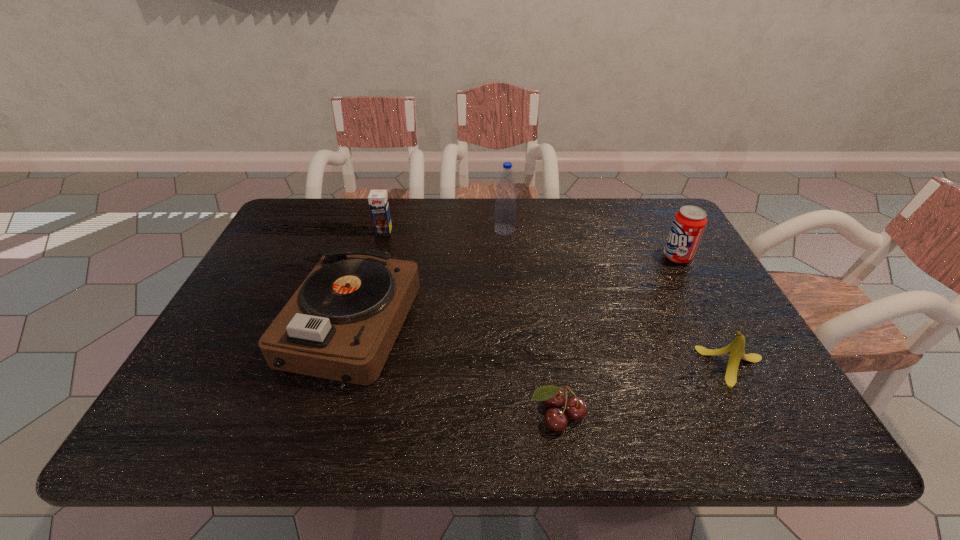
Where is `vacant region at the left edge of the desktop`? This screenshot has width=960, height=540. vacant region at the left edge of the desktop is located at coordinates (217, 336).

The width and height of the screenshot is (960, 540). Identify the location of free space at the right edge of the desktop. (684, 267).

Locate an element on the screen. This screenshot has height=540, width=960. vacant region at the far left corner of the desktop is located at coordinates (299, 201).

Where is `vacant space at the near left corner of the desktop`? vacant space at the near left corner of the desktop is located at coordinates (181, 419).

In the image, there is a desktop. Where is `vacant space at the far right corner`? Image resolution: width=960 pixels, height=540 pixels. vacant space at the far right corner is located at coordinates pos(665,204).

The height and width of the screenshot is (540, 960). I want to click on free space between the cherry and the record player, so click(454, 371).

The width and height of the screenshot is (960, 540). I want to click on vacant region between the shortest object and the soda can, so click(x=617, y=336).

Where is `vacant region between the soda can and the banana`? The width and height of the screenshot is (960, 540). vacant region between the soda can and the banana is located at coordinates (707, 312).

Image resolution: width=960 pixels, height=540 pixels. What are the coordinates of `vacant area that lies between the record player and the fourth nearest object` in the screenshot? It's located at (514, 292).

At what (x,y) coordinates should I click in order to perform the action: click on free point between the banana and the cherry. Please return your answer as a coordinate pair (x, y). This screenshot has width=960, height=540. Looking at the image, I should click on (646, 391).